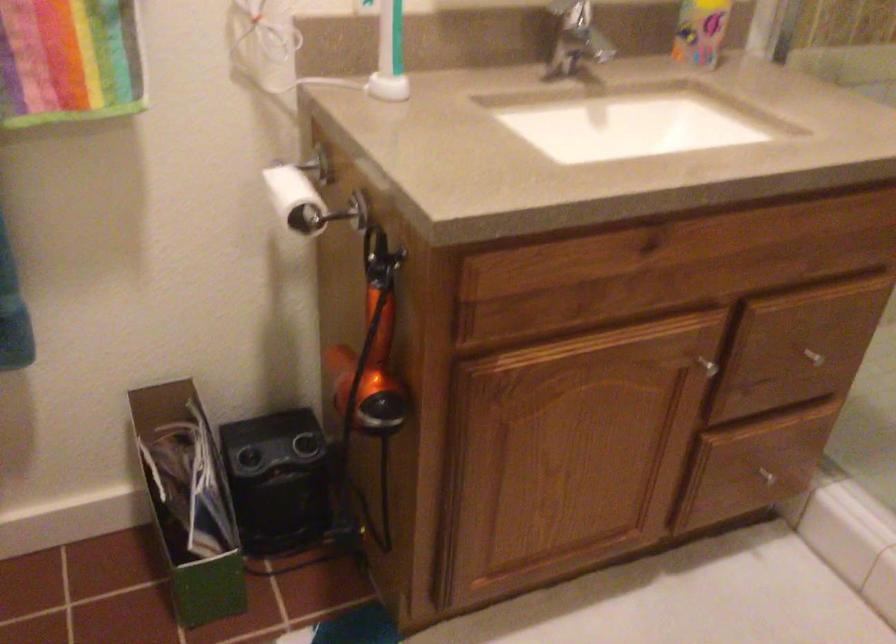
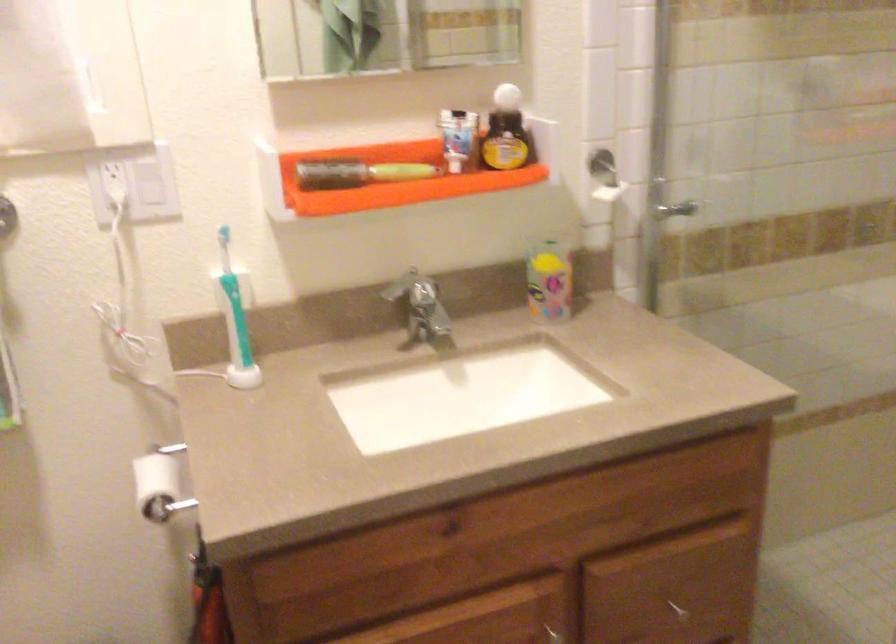
Locate, in the second image, the point that corresponds to [812,362] in the first image.

(677, 609)